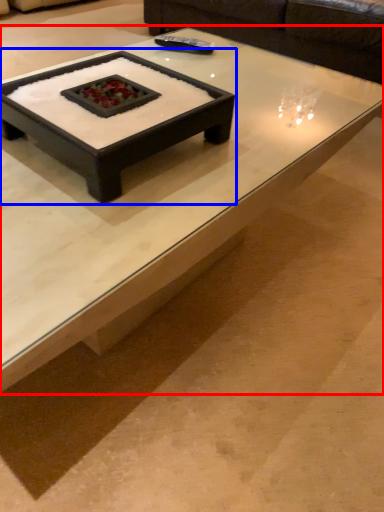
Question: Which object appears farthest to the camera in this image, coffee table (highlighted by a red box) or coffee table (highlighted by a blue box)?

Choices:
 (A) coffee table
 (B) coffee table

Answer: (B)